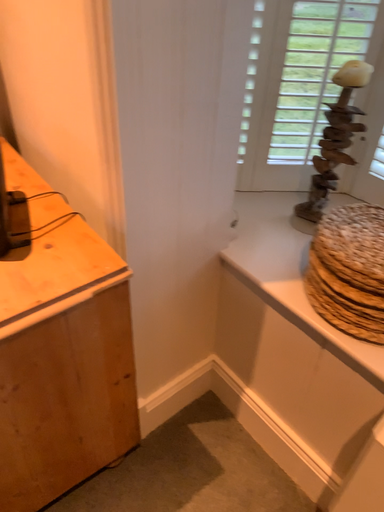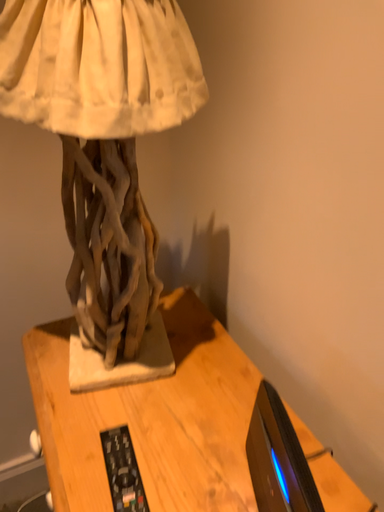
Question: Which way did the camera rotate in the video?

Choices:
 (A) rotated right
 (B) rotated left

Answer: (B)